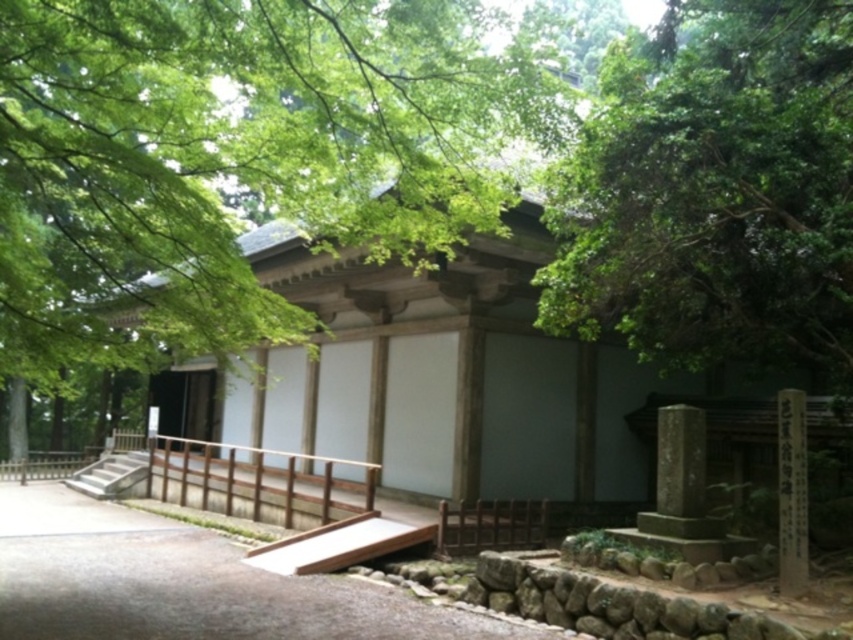
Question: Is green leafy tree at center above brown wooden rail at center?

Choices:
 (A) no
 (B) yes

Answer: (B)

Question: Which object is the farthest from the brown gravel path at center?

Choices:
 (A) green leafy tree at center
 (B) black stone pillar at lower right

Answer: (B)

Question: Which point is closer to the camera?

Choices:
 (A) green leafy tree at center
 (B) gray concrete stairs at lower left
 (C) black stone pillar at lower right

Answer: (A)

Question: Can you confirm if green leafy tree at upper right is positioned above brown gravel path at center?

Choices:
 (A) yes
 (B) no

Answer: (A)

Question: Which of the following is the closest to the observer?

Choices:
 (A) brown wooden rail at center
 (B) black stone pillar at lower right
 (C) green leafy tree at upper right
 (D) brown gravel path at center

Answer: (D)

Question: In this image, where is brown gravel path at center located relative to gray concrete stairs at lower left?

Choices:
 (A) right
 (B) left

Answer: (A)